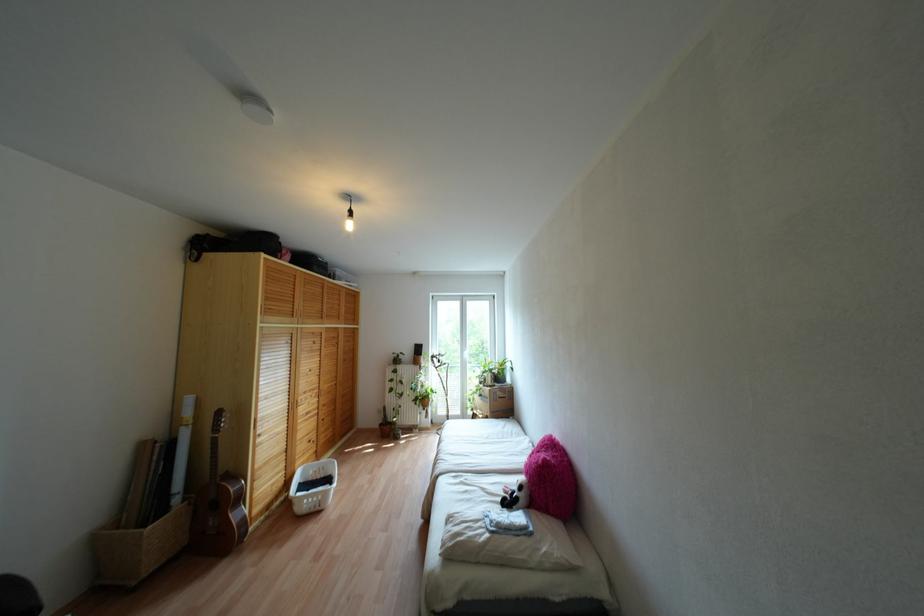
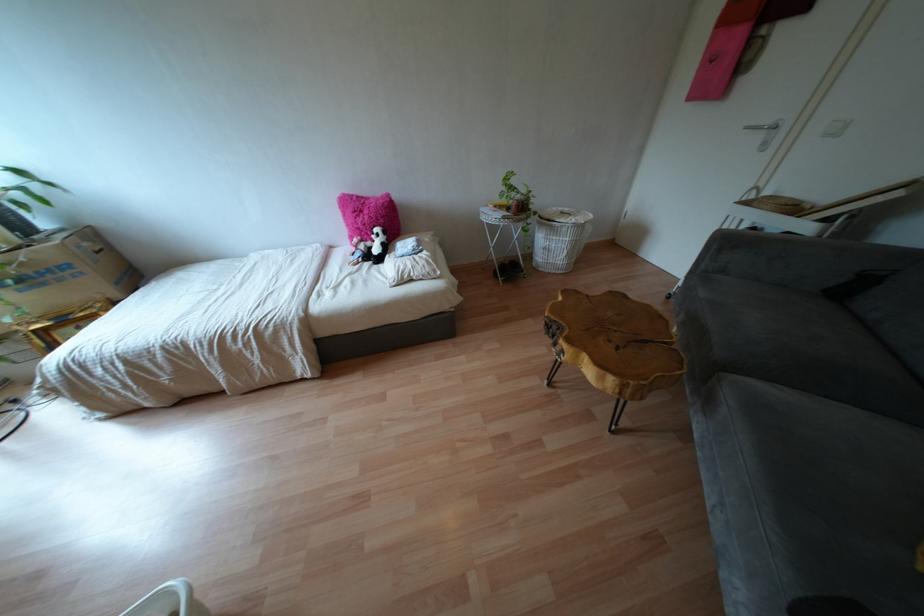
Find the pixel in the second image that matches point (482, 488) in the first image.

(349, 274)